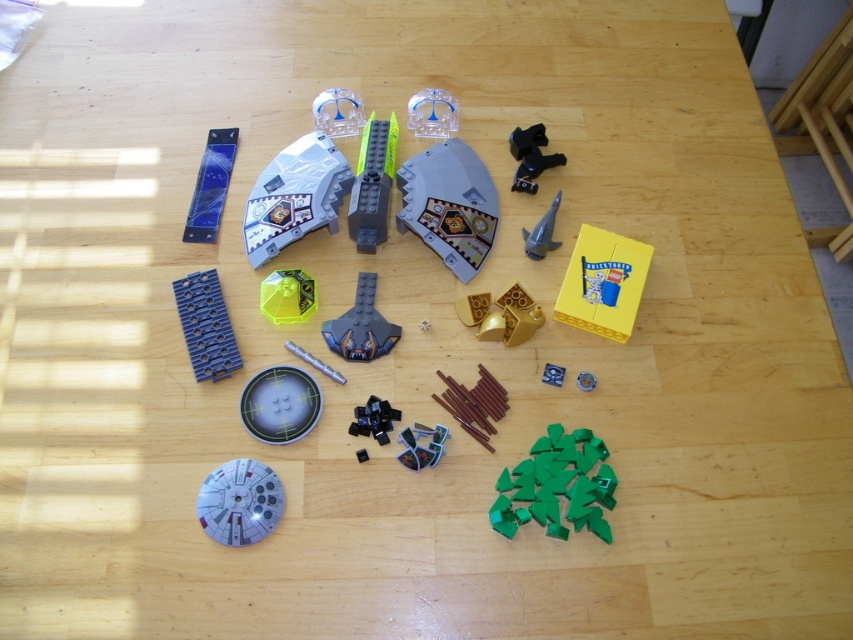
Question: From the image, what is the correct spatial relationship of transparent plastic rectangular block at upper left in relation to metallic blue gear at center?

Choices:
 (A) right
 (B) left

Answer: (B)

Question: Which of the following is the closest to the observer?

Choices:
 (A) dark gray plastic at center
 (B) metallic silver rod at center
 (C) satin silver spaceship at center
 (D) matte gray circle at center

Answer: (D)

Question: Among these objects, which one is farthest from the camera?

Choices:
 (A) gold metallic gear at center
 (B) dark gray plastic at center
 (C) yellow matte box at center right
 (D) transparent blue dome at upper center

Answer: (D)

Question: Is translucent gray plastic spaceship at upper center in front of brown matte stick at center?

Choices:
 (A) yes
 (B) no

Answer: (B)

Question: Can you confirm if matte gray circle at center is thinner than gold metallic gear at center?

Choices:
 (A) no
 (B) yes

Answer: (A)

Question: Which point is farther from the camera taking this photo?

Choices:
 (A) (608, 260)
 (B) (289, 349)

Answer: (A)